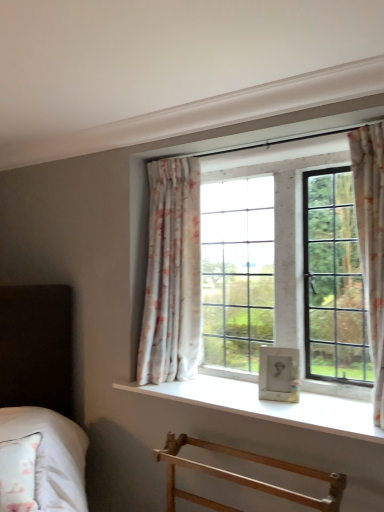
Question: Can you confirm if light wood towel rack at lower center is thinner than floral fabric curtain at right, which ranks as the first curtain in right-to-left order?

Choices:
 (A) no
 (B) yes

Answer: (A)

Question: From the image's perspective, is light wood towel rack at lower center below floral fabric curtain at right, which ranks as the first curtain in right-to-left order?

Choices:
 (A) yes
 (B) no

Answer: (A)

Question: Is light wood towel rack at lower center positioned far away from floral fabric curtain at right, the 1th curtain from the front?

Choices:
 (A) no
 (B) yes

Answer: (A)

Question: Can you confirm if light wood towel rack at lower center is shorter than floral fabric curtain at right, the 2th curtain in the back-to-front sequence?

Choices:
 (A) yes
 (B) no

Answer: (A)

Question: Is light wood towel rack at lower center facing away from floral fabric curtain at right, which ranks as the first curtain in right-to-left order?

Choices:
 (A) no
 (B) yes

Answer: (A)

Question: Considering the positions of light wood towel rack at lower center and white smooth window sill at center in the image, is light wood towel rack at lower center taller or shorter than white smooth window sill at center?

Choices:
 (A) short
 (B) tall

Answer: (B)

Question: Does point (157, 454) appear closer or farther from the camera than point (238, 390)?

Choices:
 (A) closer
 (B) farther

Answer: (A)

Question: Considering the positions of light wood towel rack at lower center and white smooth window sill at center in the image, is light wood towel rack at lower center bigger or smaller than white smooth window sill at center?

Choices:
 (A) big
 (B) small

Answer: (A)

Question: Choose the correct answer: Is light wood towel rack at lower center inside white smooth window sill at center or outside it?

Choices:
 (A) inside
 (B) outside

Answer: (B)

Question: From the image's perspective, is floral fabric curtain at right, the 2th curtain in the back-to-front sequence, located above or below floral fabric curtain at upper center, placed as the second curtain when sorted from front to back?

Choices:
 (A) below
 (B) above

Answer: (B)

Question: Considering the relative positions of floral fabric curtain at right, the 1th curtain from the front, and floral fabric curtain at upper center, placed as the second curtain when sorted from front to back, in the image provided, is floral fabric curtain at right, the 1th curtain from the front, to the left or to the right of floral fabric curtain at upper center, placed as the second curtain when sorted from front to back,?

Choices:
 (A) left
 (B) right

Answer: (B)

Question: Is floral fabric curtain at right, the 2th curtain in the back-to-front sequence, taller or shorter than floral fabric curtain at upper center, positioned as the 1th curtain in back-to-front order?

Choices:
 (A) tall
 (B) short

Answer: (A)

Question: Is floral fabric curtain at right, the 2th curtain in the back-to-front sequence, wider or thinner than floral fabric curtain at upper center, placed as the second curtain when sorted from front to back?

Choices:
 (A) wide
 (B) thin

Answer: (B)

Question: Considering the positions of floral fabric curtain at upper center, positioned as the 1th curtain in back-to-front order, and white smooth window sill at center in the image, is floral fabric curtain at upper center, positioned as the 1th curtain in back-to-front order, wider or thinner than white smooth window sill at center?

Choices:
 (A) wide
 (B) thin

Answer: (B)

Question: Considering the relative positions of floral fabric curtain at upper center, positioned as the 1th curtain in back-to-front order, and white smooth window sill at center in the image provided, is floral fabric curtain at upper center, positioned as the 1th curtain in back-to-front order, to the left or to the right of white smooth window sill at center?

Choices:
 (A) right
 (B) left

Answer: (B)